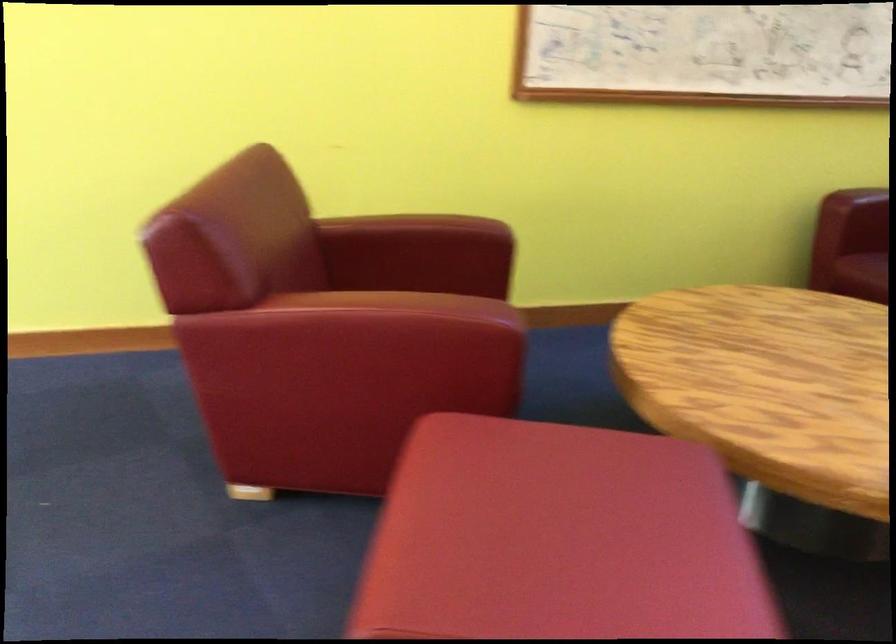
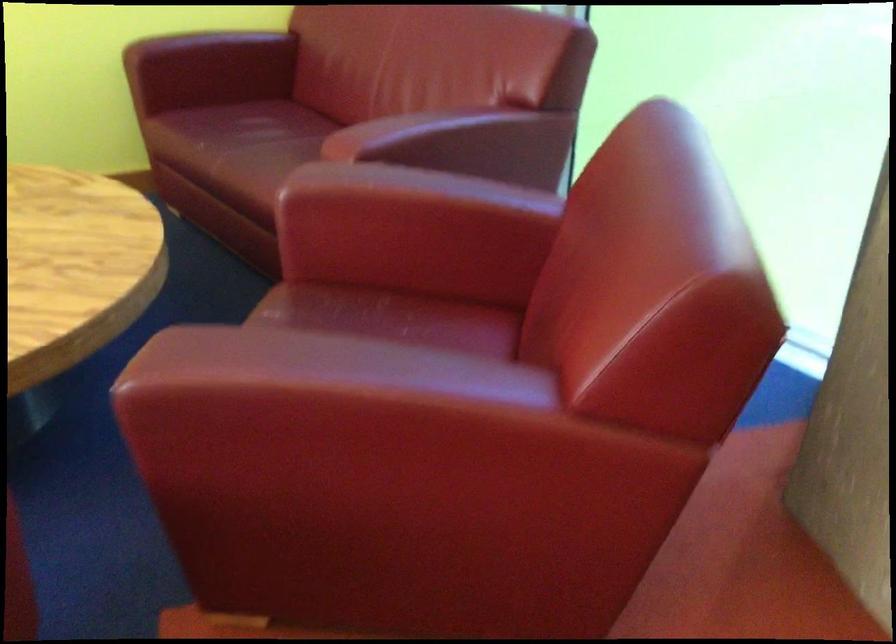
Question: In a continuous first-person perspective shot, in which direction is the camera moving?

Choices:
 (A) Left
 (B) Right
 (C) Forward
 (D) Backward

Answer: (B)